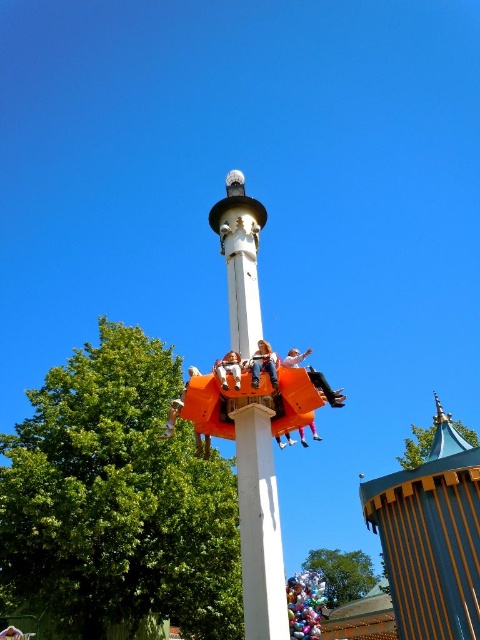
Question: Which object is farther from the camera taking this photo?

Choices:
 (A) white smooth pole at center
 (B) matte orange slide at center
 (C) orange plastic seat at center
 (D) orange plastic person at center

Answer: (B)

Question: Can you confirm if orange plastic amusement park ride at center is smaller than wooden striped tower at center?

Choices:
 (A) yes
 (B) no

Answer: (B)

Question: Is wooden striped tower at center thinner than matte orange slide at center?

Choices:
 (A) yes
 (B) no

Answer: (B)

Question: Which point appears farthest from the camera in this image?

Choices:
 (A) (297, 364)
 (B) (412, 532)

Answer: (B)

Question: Which point is farther to the camera?

Choices:
 (A) (279, 388)
 (B) (248, 630)
 (C) (416, 600)

Answer: (C)

Question: Is wooden striped tower at center behind orange plastic person at center?

Choices:
 (A) no
 (B) yes

Answer: (B)